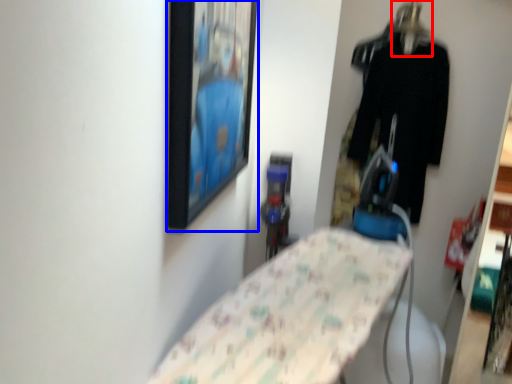
Question: Which object is further to the camera taking this photo, hanger (highlighted by a red box) or picture frame (highlighted by a blue box)?

Choices:
 (A) hanger
 (B) picture frame

Answer: (A)